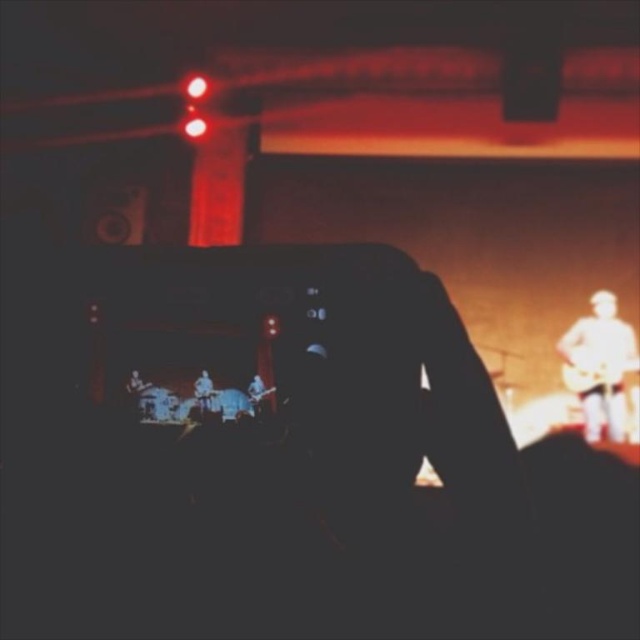
You are holding a smartphone and want to focus on the stage in the live music performance. The phone screen shows two points marked as point 1 at coordinates (x=589, y=376) and point 2 at coordinates (x=257, y=380). Which point is closer to your eye when looking through the camera?

Point 1 at coordinates (x=589, y=376) is closer to your eye because it is further to the viewer than point 2 at coordinates (x=257, y=380).

You are a photographer trying to capture a clear image of both the light brown wooden guitar at right and the wooden acoustic guitar at right on the stage. Given that the smartphone screen shows a slightly blurred view, which guitar would appear wider in the photo?

The light brown wooden guitar at right would appear wider in the photo because its width is larger than the wooden acoustic guitar at right.